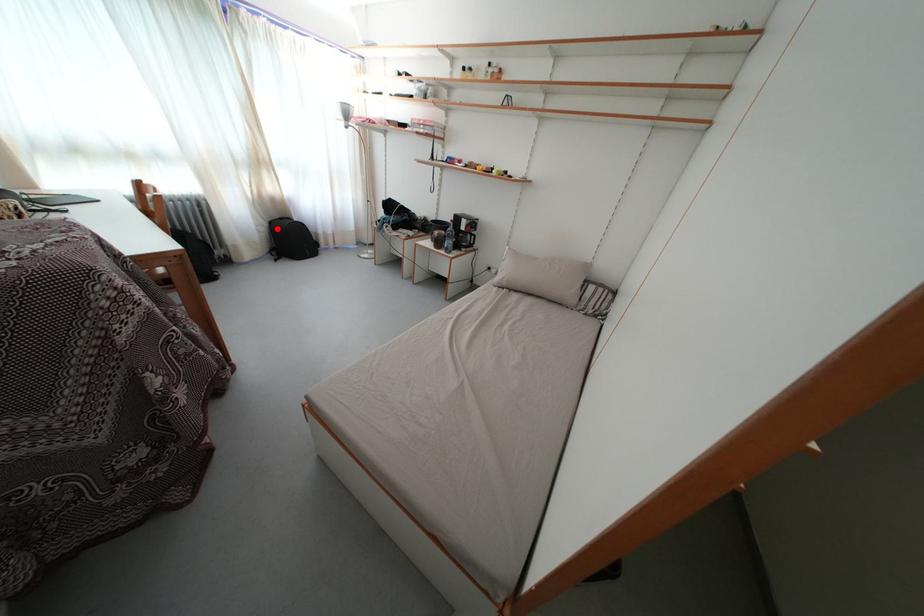
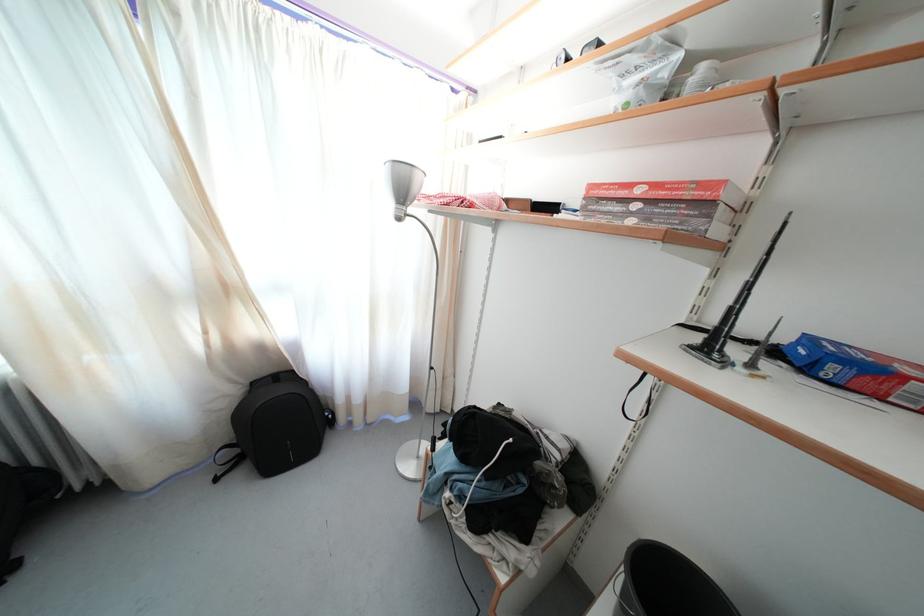
The point at the highlighted location is marked in the first image. Where is the corresponding point in the second image?

(259, 390)